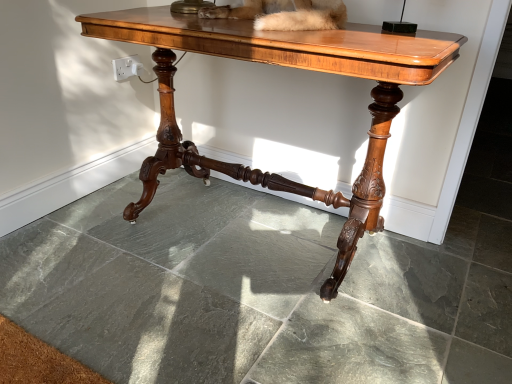
Find the location of a particular element. Image resolution: width=512 pixels, height=384 pixels. free space to the left of shiny wood table at center is located at coordinates (91, 249).